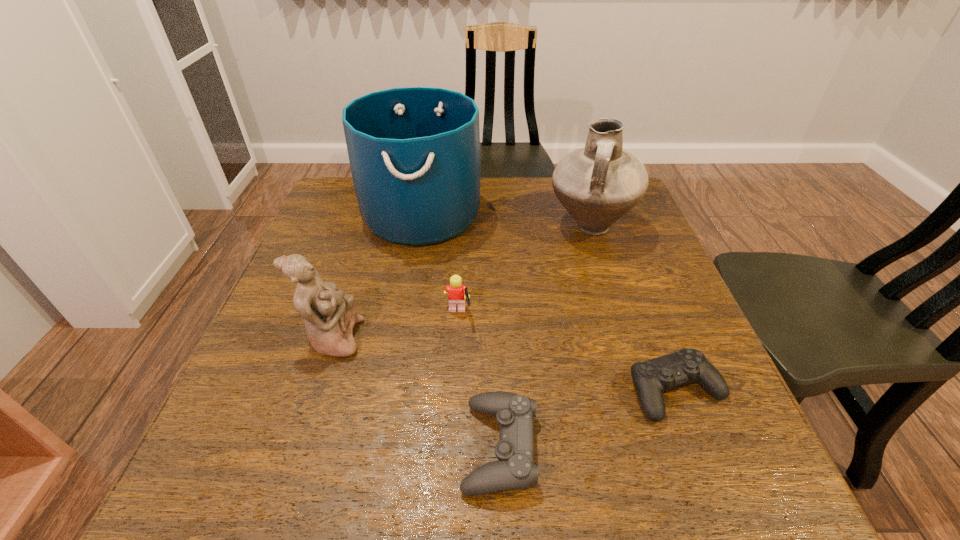
You are a GUI agent. You are given a task and a screenshot of the screen. Output one action in this format:
    pyautogui.click(x=<x>, y=<y>)
    Task: Click on the vacant position in the image that satisfies the following two spatial constraints: 1. in front of the Lego with the accessory visible; 2. on the left side of the left control
    The width and height of the screenshot is (960, 540).
    Given the screenshot: What is the action you would take?
    pyautogui.click(x=451, y=447)

At what (x,y) coordinates should I click in order to perform the action: click on vacant position in the image that satisfies the following two spatial constraints: 1. on the front side of the bucket; 2. on the right side of the right control. Please return your answer as a coordinate pair (x, y). Looking at the image, I should click on (391, 391).